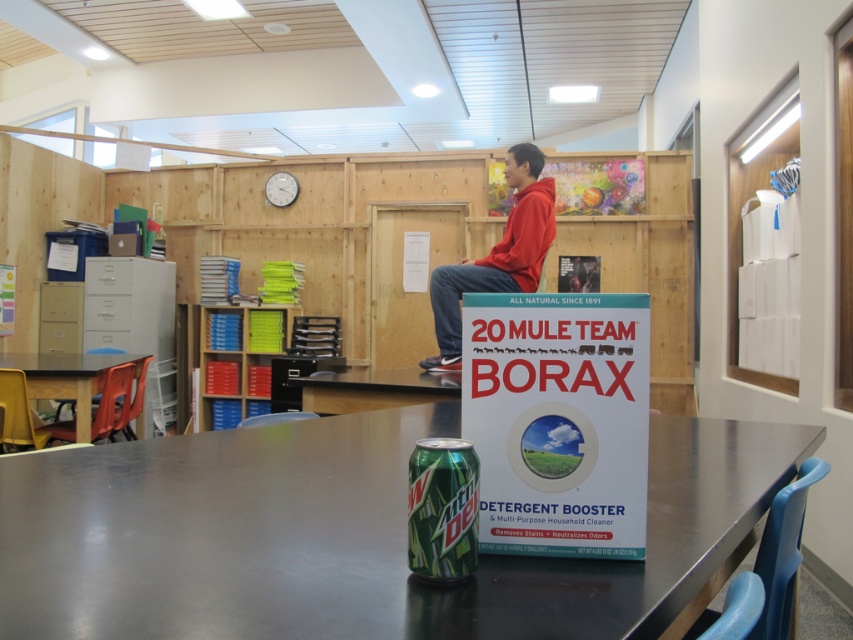
Is point (440, 529) positioned before point (83, 403)?

That is True.

Find the location of a particular element. The height and width of the screenshot is (640, 853). green matte mountain dew can at center is located at coordinates (442, 509).

Between red hoodie at upper center and green matte mountain dew can at center, which one has less height?

With less height is green matte mountain dew can at center.

Does red hoodie at upper center have a greater width compared to green matte mountain dew can at center?

Correct, the width of red hoodie at upper center exceeds that of green matte mountain dew can at center.

Does point (515, 182) lie in front of point (460, 464)?

No, it is behind (460, 464).

Where is `red hoodie at upper center`? The height and width of the screenshot is (640, 853). red hoodie at upper center is located at coordinates (497, 253).

Is metallic gray table at center above red hoodie at upper center?

No.

Does point (796, 444) come behind point (509, 237)?

No, it is not.

Describe the element at coordinates (354, 536) in the screenshot. The height and width of the screenshot is (640, 853). I see `metallic gray table at center` at that location.

Identify the location of metallic gray table at center. This screenshot has height=640, width=853. (354, 536).